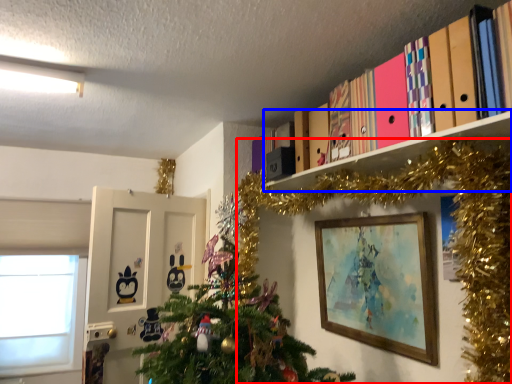
Question: Among these objects, which one is nearest to the camera, christmas tree (highlighted by a red box) or shelf (highlighted by a blue box)?

Choices:
 (A) christmas tree
 (B) shelf

Answer: (A)